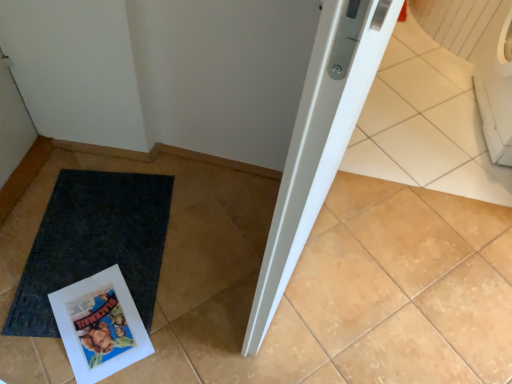
Question: Is black rubber mat at lower left closer to camera compared to white glossy comic book at lower left?

Choices:
 (A) no
 (B) yes

Answer: (A)

Question: Is black rubber mat at lower left facing towards white glossy comic book at lower left?

Choices:
 (A) yes
 (B) no

Answer: (A)

Question: From the image's perspective, is black rubber mat at lower left located beneath white glossy comic book at lower left?

Choices:
 (A) yes
 (B) no

Answer: (B)

Question: Is black rubber mat at lower left not within white glossy comic book at lower left?

Choices:
 (A) yes
 (B) no

Answer: (A)

Question: Does black rubber mat at lower left have a lesser height compared to white glossy comic book at lower left?

Choices:
 (A) no
 (B) yes

Answer: (B)

Question: Is black rubber mat at lower left touching white glossy comic book at lower left?

Choices:
 (A) yes
 (B) no

Answer: (B)

Question: Could you tell me if white glossy comic book at lower left is turned towards black rubber mat at lower left?

Choices:
 (A) yes
 (B) no

Answer: (A)

Question: From the image's perspective, does white glossy comic book at lower left appear lower than black rubber mat at lower left?

Choices:
 (A) no
 (B) yes

Answer: (B)

Question: Would you say white glossy comic book at lower left contains black rubber mat at lower left?

Choices:
 (A) yes
 (B) no

Answer: (B)

Question: Is white glossy comic book at lower left in front of black rubber mat at lower left?

Choices:
 (A) yes
 (B) no

Answer: (A)

Question: Can you confirm if white glossy comic book at lower left is bigger than black rubber mat at lower left?

Choices:
 (A) yes
 (B) no

Answer: (B)

Question: From a real-world perspective, is white glossy comic book at lower left located beneath black rubber mat at lower left?

Choices:
 (A) no
 (B) yes

Answer: (A)

Question: In terms of width, does black rubber mat at lower left look wider or thinner when compared to white glossy comic book at lower left?

Choices:
 (A) thin
 (B) wide

Answer: (B)